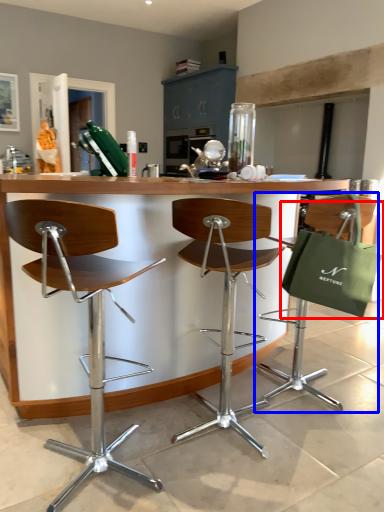
Question: Among these objects, which one is nearest to the camera, shopping bag (highlighted by a red box) or chair (highlighted by a blue box)?

Choices:
 (A) shopping bag
 (B) chair

Answer: (A)